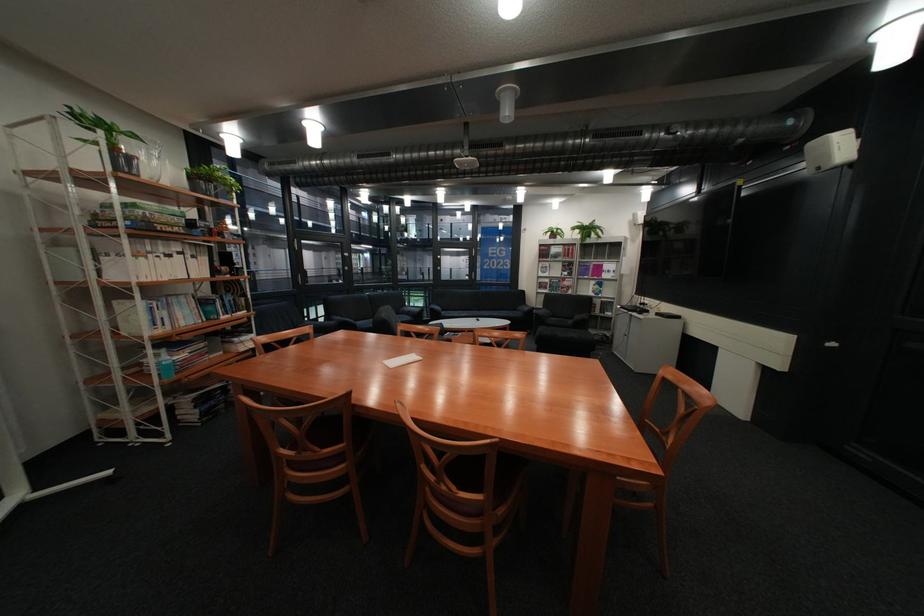
What do you see at coordinates (506, 116) in the screenshot? This screenshot has height=616, width=924. I see `the bottle pump handle` at bounding box center [506, 116].